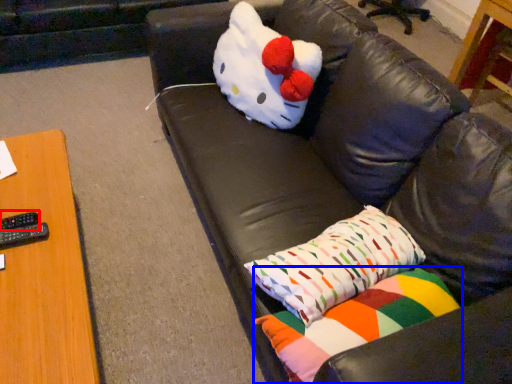
Question: Which point is closer to the camera, remote (highlighted by a red box) or pillow (highlighted by a blue box)?

Choices:
 (A) remote
 (B) pillow

Answer: (B)